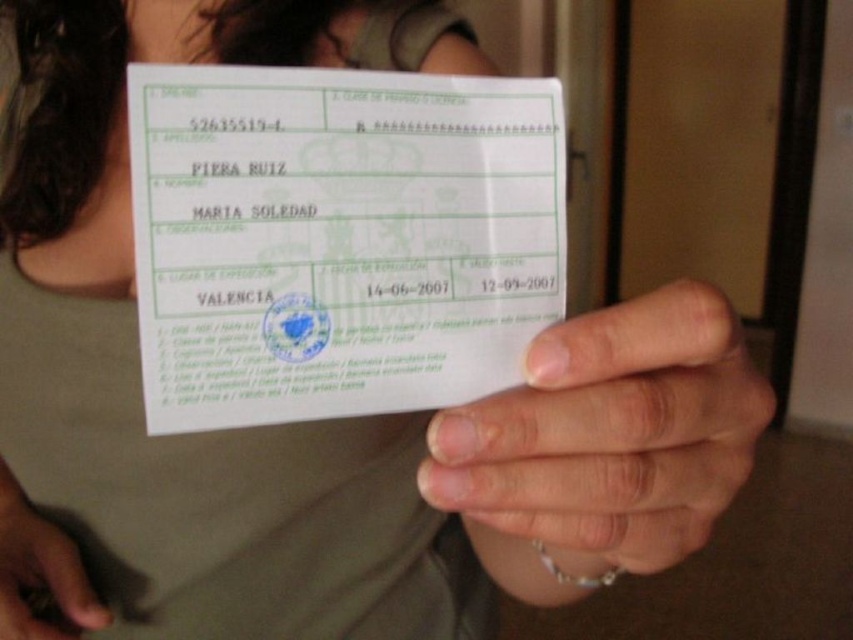
Does smooth skin at center have a lesser width compared to matte silver ring at lower left?

Incorrect, smooth skin at center's width is not less than matte silver ring at lower left's.

Where is `smooth skin at center`? smooth skin at center is located at coordinates (605, 440).

Locate an element on the screen. This screenshot has height=640, width=853. smooth skin at center is located at coordinates (605, 440).

Is white paper receipt at center taller than matte silver ring at lower left?

Yes, white paper receipt at center is taller than matte silver ring at lower left.

Is white paper receipt at center positioned behind matte silver ring at lower left?

No, white paper receipt at center is closer to the viewer.

Locate an element on the screen. This screenshot has height=640, width=853. white paper receipt at center is located at coordinates click(x=339, y=240).

The width and height of the screenshot is (853, 640). I want to click on white paper receipt at center, so click(x=339, y=240).

Is white paper receipt at center behind smooth skin at center?

That is True.

Where is `white paper receipt at center`? white paper receipt at center is located at coordinates (339, 240).

The image size is (853, 640). In order to click on white paper receipt at center in this screenshot , I will do `click(339, 240)`.